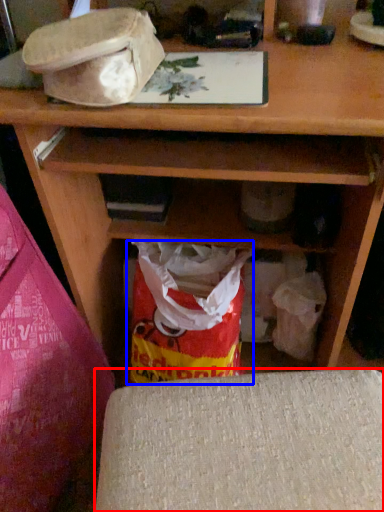
Question: Which object appears farthest to the camera in this image, furniture (highlighted by a red box) or grocery bag (highlighted by a blue box)?

Choices:
 (A) furniture
 (B) grocery bag

Answer: (B)